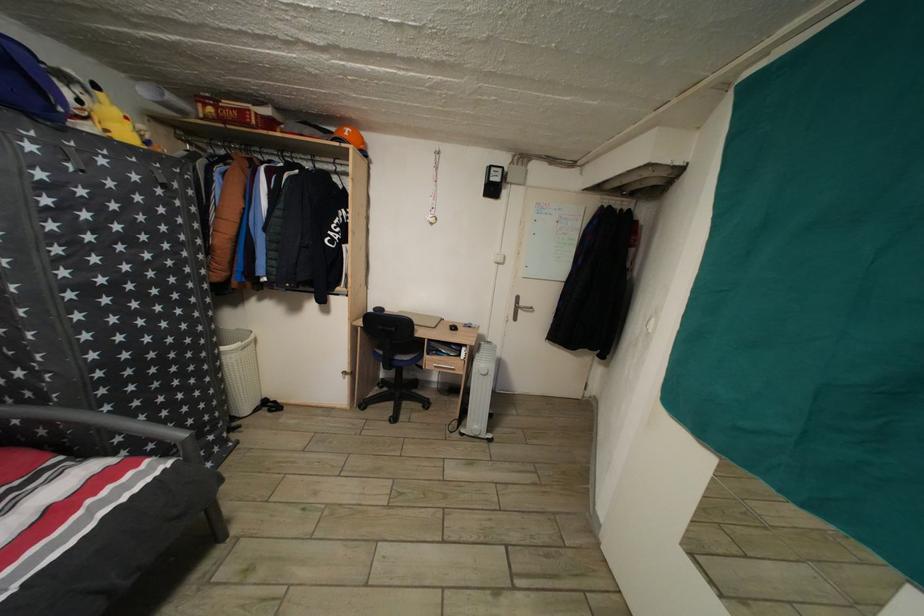
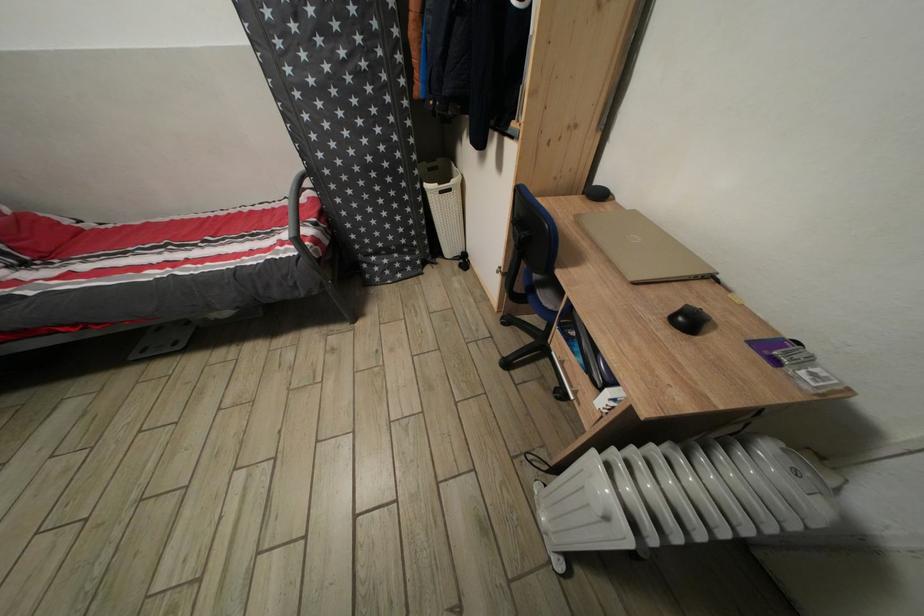
Find the pixel in the second image that matches pixel 229 355 in the first image.

(432, 192)